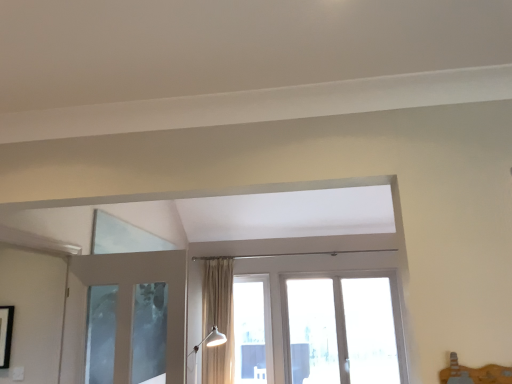
Question: From a real-world perspective, is clear glass window at center below white glossy floor lamp at lower center?

Choices:
 (A) no
 (B) yes

Answer: (A)

Question: Can you confirm if clear glass window at center is positioned to the left of white glossy floor lamp at lower center?

Choices:
 (A) no
 (B) yes

Answer: (A)

Question: Does clear glass window at center have a lesser height compared to white glossy floor lamp at lower center?

Choices:
 (A) yes
 (B) no

Answer: (B)

Question: From the image's perspective, is clear glass window at center below white glossy floor lamp at lower center?

Choices:
 (A) no
 (B) yes

Answer: (A)

Question: Is clear glass window at center wider than white glossy floor lamp at lower center?

Choices:
 (A) yes
 (B) no

Answer: (B)

Question: Considering the relative sizes of clear glass window at center and white glossy floor lamp at lower center in the image provided, is clear glass window at center thinner than white glossy floor lamp at lower center?

Choices:
 (A) no
 (B) yes

Answer: (B)

Question: Is white glossy floor lamp at lower center far from clear glass window at center?

Choices:
 (A) no
 (B) yes

Answer: (B)

Question: From a real-world perspective, is white glossy floor lamp at lower center on top of clear glass window at center?

Choices:
 (A) no
 (B) yes

Answer: (A)

Question: Does white glossy floor lamp at lower center have a larger size compared to clear glass window at center?

Choices:
 (A) no
 (B) yes

Answer: (B)

Question: Is white glossy floor lamp at lower center in contact with clear glass window at center?

Choices:
 (A) no
 (B) yes

Answer: (A)

Question: Can clear glass window at center be found inside white glossy floor lamp at lower center?

Choices:
 (A) yes
 (B) no

Answer: (B)

Question: Can we say white glossy floor lamp at lower center lies outside clear glass window at center?

Choices:
 (A) no
 (B) yes

Answer: (B)

Question: Is clear glass window at center not near beige fabric curtain at center?

Choices:
 (A) yes
 (B) no

Answer: (B)